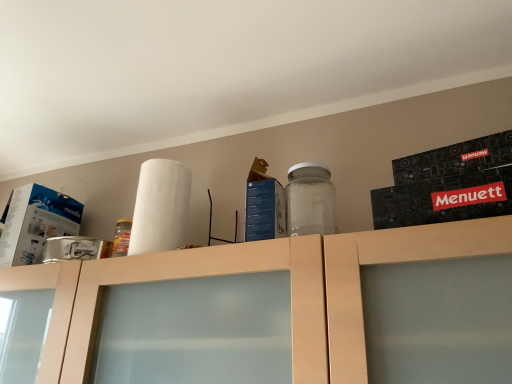
Question: From the image's perspective, is white matte paper towel at upper center above or below matte wood cabinet at upper center?

Choices:
 (A) below
 (B) above

Answer: (B)

Question: In terms of height, does white matte paper towel at upper center look taller or shorter compared to matte wood cabinet at upper center?

Choices:
 (A) short
 (B) tall

Answer: (A)

Question: Which of these objects is positioned farthest from the white cardboard box at left, which appears as the 2th box when viewed from the front?

Choices:
 (A) matte wood cabinet at upper center
 (B) blue cardboard box at center, the first box when ordered from front to back
 (C) white matte paper towel at upper center

Answer: (B)

Question: Considering the real-world distances, which object is farthest from the white matte paper towel at upper center?

Choices:
 (A) blue cardboard box at center, the first box from the right
 (B) white cardboard box at left, placed as the 1th box when sorted from back to front
 (C) matte wood cabinet at upper center

Answer: (B)